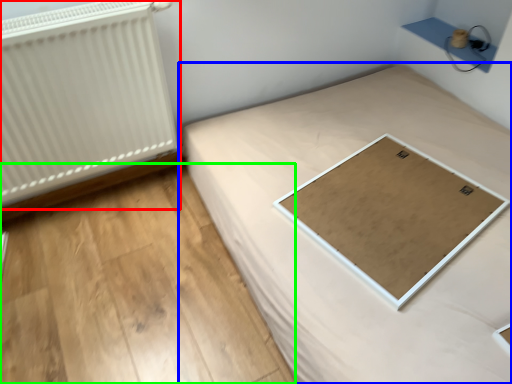
Question: Which is farther away from radiator (highlighted by a red box)? bed (highlighted by a blue box) or plywood (highlighted by a green box)?

Choices:
 (A) bed
 (B) plywood

Answer: (A)